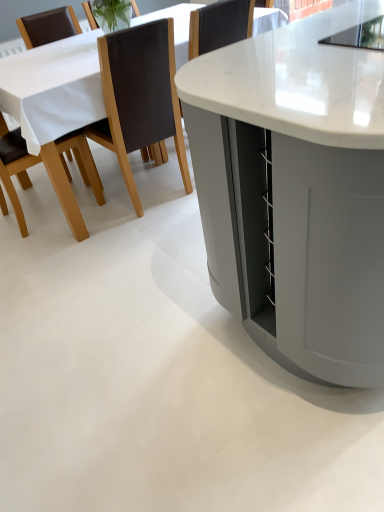
Identify the location of brown leather chair at upper left, the 2th chair positioned from the left. (139, 97).

Based on the photo, measure the distance between brown leather chair at left, the 1th chair viewed from the left, and camera.

A distance of 6.84 feet exists between brown leather chair at left, the 1th chair viewed from the left, and camera.

The width and height of the screenshot is (384, 512). Describe the element at coordinates (55, 104) in the screenshot. I see `white marble table at center, the 2th table from the front` at that location.

Locate an element on the screen. white marble table at center, placed as the second table when sorted from back to front is located at coordinates (296, 190).

Find the location of a particular element. The height and width of the screenshot is (512, 384). brown leather chair at upper left, which is the 1th chair from right to left is located at coordinates (139, 97).

Can you confirm if white marble table at center, positioned as the first table in front-to-back order, is bigger than white marble table at center, the 2th table from the front?

No.

From the image's perspective, is white marble table at center, placed as the second table when sorted from back to front, above white marble table at center, the 2th table from the front?

No, from the image's perspective, white marble table at center, placed as the second table when sorted from back to front, is not above white marble table at center, the 2th table from the front.

The height and width of the screenshot is (512, 384). In order to click on table below the white marble table at center, the 1th table viewed from the back (from the image's perspective) in this screenshot , I will do `click(296, 190)`.

Which of these two, white marble table at center, positioned as the first table in front-to-back order, or white marble table at center, the 1th table viewed from the back, is thinner?

Thinner between the two is white marble table at center, positioned as the first table in front-to-back order.

How different are the orientations of brown leather chair at upper left, the 2th chair positioned from the left, and white marble table at center, placed as the second table when sorted from back to front, in degrees?

There is a 177-degree angle between the facing directions of brown leather chair at upper left, the 2th chair positioned from the left, and white marble table at center, placed as the second table when sorted from back to front.

Considering the relative positions of brown leather chair at upper left, the 2th chair positioned from the left, and white marble table at center, positioned as the first table in front-to-back order, in the image provided, is brown leather chair at upper left, the 2th chair positioned from the left, to the left or to the right of white marble table at center, positioned as the first table in front-to-back order,?

Based on their positions, brown leather chair at upper left, the 2th chair positioned from the left, is located to the left of white marble table at center, positioned as the first table in front-to-back order.

Are brown leather chair at upper left, the 2th chair positioned from the left, and white marble table at center, placed as the second table when sorted from back to front, located far from each other?

Indeed, brown leather chair at upper left, the 2th chair positioned from the left, is not near white marble table at center, placed as the second table when sorted from back to front.

Does brown leather chair at upper left, the 2th chair positioned from the left, turn towards white marble table at center, positioned as the first table in front-to-back order?

No, brown leather chair at upper left, the 2th chair positioned from the left, does not turn towards white marble table at center, positioned as the first table in front-to-back order.

Choose the correct answer: Is white marble table at center, placed as the second table when sorted from back to front, inside brown leather chair at upper left, which is the 1th chair from right to left, or outside it?

The correct answer is: outside.

Which object is thinner, white marble table at center, placed as the second table when sorted from back to front, or brown leather chair at upper left, which is the 1th chair from right to left?

With smaller width is brown leather chair at upper left, which is the 1th chair from right to left.

Looking at this image, from the image's perspective, does white marble table at center, placed as the second table when sorted from back to front, appear lower than brown leather chair at upper left, which is the 1th chair from right to left?

Yes, from the image's perspective, white marble table at center, placed as the second table when sorted from back to front, is below brown leather chair at upper left, which is the 1th chair from right to left.

Where is `the 1st chair to the left of the white marble table at center, positioned as the first table in front-to-back order, counting from the anchor's position`? the 1st chair to the left of the white marble table at center, positioned as the first table in front-to-back order, counting from the anchor's position is located at coordinates (139, 97).

Is brown leather chair at left, the 1th chair viewed from the left, outside of white marble table at center, placed as the second table when sorted from back to front?

Yes.

In the scene shown: Is brown leather chair at left, the 2th chair in the right-to-left sequence, placed right next to white marble table at center, placed as the second table when sorted from back to front?

No, brown leather chair at left, the 2th chair in the right-to-left sequence, is not touching white marble table at center, placed as the second table when sorted from back to front.

Can you confirm if brown leather chair at left, the 2th chair in the right-to-left sequence, is positioned to the left of white marble table at center, positioned as the first table in front-to-back order?

Yes, brown leather chair at left, the 2th chair in the right-to-left sequence, is to the left of white marble table at center, positioned as the first table in front-to-back order.

Which is behind, point (77, 229) or point (359, 290)?

The point (77, 229) is more distant.

Considering the positions of objects white marble table at center, positioned as the first table in front-to-back order, and brown leather chair at left, the 1th chair viewed from the left, in the image provided, who is in front, white marble table at center, positioned as the first table in front-to-back order, or brown leather chair at left, the 1th chair viewed from the left,?

white marble table at center, positioned as the first table in front-to-back order, is in front.

Considering the points (253, 296) and (41, 42), which point is behind, point (253, 296) or point (41, 42)?

The point (41, 42) is behind.

Is white marble table at center, placed as the second table when sorted from back to front, looking in the opposite direction of brown leather chair at left, the 1th chair viewed from the left?

Correct, white marble table at center, placed as the second table when sorted from back to front, is looking away from brown leather chair at left, the 1th chair viewed from the left.

Based on their sizes in the image, would you say white marble table at center, placed as the second table when sorted from back to front, is bigger or smaller than brown leather chair at left, the 2th chair in the right-to-left sequence?

Considering their sizes, white marble table at center, placed as the second table when sorted from back to front, takes up more space than brown leather chair at left, the 2th chair in the right-to-left sequence.

The height and width of the screenshot is (512, 384). Find the location of `table behind the white marble table at center, positioned as the first table in front-to-back order`. table behind the white marble table at center, positioned as the first table in front-to-back order is located at coordinates (55, 104).

Does white marble table at center, the 1th table viewed from the back, have a lesser height compared to white marble table at center, placed as the second table when sorted from back to front?

Yes, white marble table at center, the 1th table viewed from the back, is shorter than white marble table at center, placed as the second table when sorted from back to front.

Who is bigger, white marble table at center, the 2th table from the front, or white marble table at center, positioned as the first table in front-to-back order?

white marble table at center, the 2th table from the front, is bigger.

Is brown leather chair at upper left, the 2th chair positioned from the left, at the back of brown leather chair at left, the 2th chair in the right-to-left sequence?

brown leather chair at left, the 2th chair in the right-to-left sequence, is not turned away from brown leather chair at upper left, the 2th chair positioned from the left.

Which object is positioned more to the right, brown leather chair at left, the 1th chair viewed from the left, or brown leather chair at upper left, the 2th chair positioned from the left?

From the viewer's perspective, brown leather chair at upper left, the 2th chair positioned from the left, appears more on the right side.

From a real-world perspective, relative to brown leather chair at upper left, the 2th chair positioned from the left, is brown leather chair at left, the 1th chair viewed from the left, vertically above or below?

From a real-world perspective, brown leather chair at left, the 1th chair viewed from the left, is physically below brown leather chair at upper left, the 2th chair positioned from the left.

This screenshot has width=384, height=512. Find the location of `table above the white marble table at center, the 2th table from the front (from a real-world perspective)`. table above the white marble table at center, the 2th table from the front (from a real-world perspective) is located at coordinates (296, 190).

At what (x,y) coordinates should I click in order to perform the action: click on table in front of the brown leather chair at upper left, the 2th chair positioned from the left. Please return your answer as a coordinate pair (x, y). The image size is (384, 512). Looking at the image, I should click on (296, 190).

When comparing their distances from white marble table at center, positioned as the first table in front-to-back order, does white marble table at center, the 2th table from the front, or brown leather chair at left, the 2th chair in the right-to-left sequence, seem further?

brown leather chair at left, the 2th chair in the right-to-left sequence, is positioned further to the anchor white marble table at center, positioned as the first table in front-to-back order.

From the picture: When comparing their distances from brown leather chair at left, the 1th chair viewed from the left, does white marble table at center, the 2th table from the front, or brown leather chair at upper left, the 2th chair positioned from the left, seem further?

The object further to brown leather chair at left, the 1th chair viewed from the left, is brown leather chair at upper left, the 2th chair positioned from the left.

Looking at this image, estimate the real-world distances between objects in this image. Which object is further from white marble table at center, the 1th table viewed from the back, brown leather chair at left, the 1th chair viewed from the left, or white marble table at center, positioned as the first table in front-to-back order?

Among the two, white marble table at center, positioned as the first table in front-to-back order, is located further to white marble table at center, the 1th table viewed from the back.

Based on their spatial positions, is white marble table at center, positioned as the first table in front-to-back order, or brown leather chair at left, the 1th chair viewed from the left, further from white marble table at center, the 1th table viewed from the back?

white marble table at center, positioned as the first table in front-to-back order, is positioned further to the anchor white marble table at center, the 1th table viewed from the back.

Which object lies further to the anchor point white marble table at center, the 2th table from the front, white marble table at center, placed as the second table when sorted from back to front, or brown leather chair at upper left, which is the 1th chair from right to left?

Based on the image, white marble table at center, placed as the second table when sorted from back to front, appears to be further to white marble table at center, the 2th table from the front.

Estimate the real-world distances between objects in this image. Which object is closer to brown leather chair at left, the 1th chair viewed from the left, brown leather chair at upper left, the 2th chair positioned from the left, or white marble table at center, the 2th table from the front?

white marble table at center, the 2th table from the front, lies closer to brown leather chair at left, the 1th chair viewed from the left, than the other object.

Looking at the image, which one is located closer to brown leather chair at left, the 2th chair in the right-to-left sequence, brown leather chair at upper left, which is the 1th chair from right to left, or white marble table at center, positioned as the first table in front-to-back order?

Based on the image, brown leather chair at upper left, which is the 1th chair from right to left, appears to be nearer to brown leather chair at left, the 2th chair in the right-to-left sequence.

When comparing their distances from white marble table at center, positioned as the first table in front-to-back order, does brown leather chair at left, the 2th chair in the right-to-left sequence, or white marble table at center, the 2th table from the front, seem further?

brown leather chair at left, the 2th chair in the right-to-left sequence, lies further to white marble table at center, positioned as the first table in front-to-back order, than the other object.

Image resolution: width=384 pixels, height=512 pixels. Identify the location of chair between white marble table at center, placed as the second table when sorted from back to front, and white marble table at center, the 2th table from the front, from front to back. (139, 97).

Find the location of `table located between brown leather chair at left, the 2th chair in the right-to-left sequence, and white marble table at center, positioned as the first table in front-to-back order, in the left-right direction`. table located between brown leather chair at left, the 2th chair in the right-to-left sequence, and white marble table at center, positioned as the first table in front-to-back order, in the left-right direction is located at coordinates (55, 104).

You are a GUI agent. You are given a task and a screenshot of the screen. Output one action in this format:
    pyautogui.click(x=<x>, y=<y>)
    Task: Click on the table between brown leather chair at left, the 1th chair viewed from the left, and brown leather chair at upper left, the 2th chair positioned from the left, in the horizontal direction
    
    Given the screenshot: What is the action you would take?
    tap(55, 104)

Locate an element on the screen. chair between brown leather chair at left, the 1th chair viewed from the left, and white marble table at center, placed as the second table when sorted from back to front is located at coordinates (139, 97).